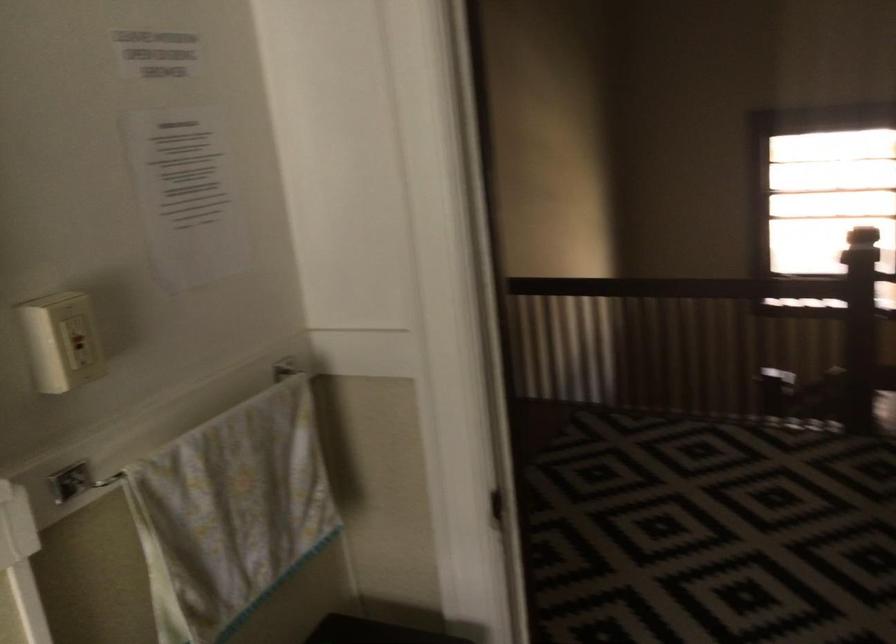
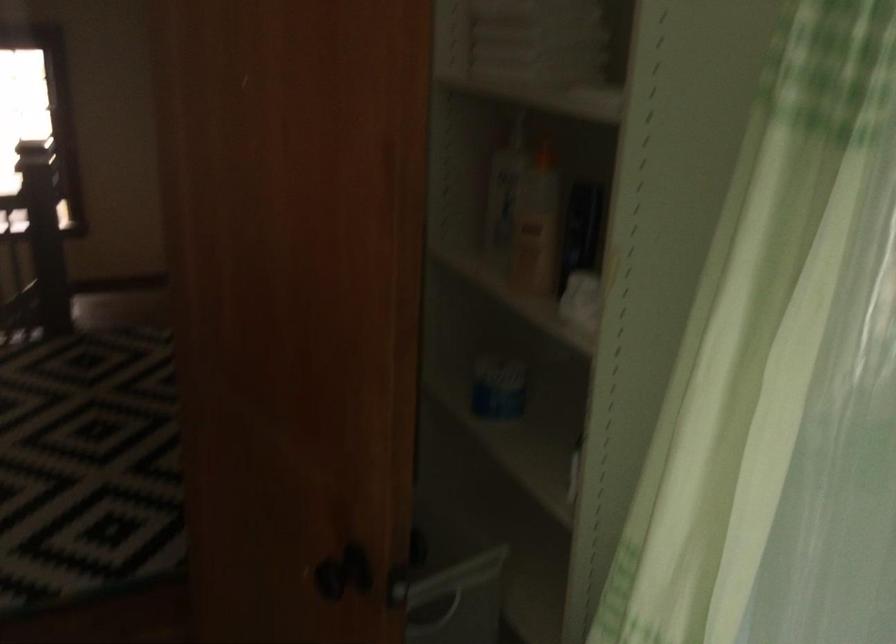
Question: The images are taken continuously from a first-person perspective. In which direction is your viewpoint rotating?

Choices:
 (A) Left
 (B) Right
 (C) Up
 (D) Down

Answer: (B)